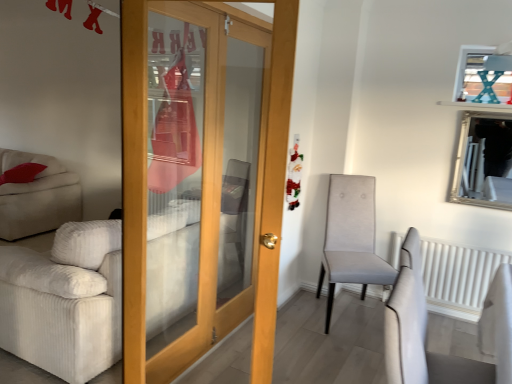
What do you see at coordinates (64, 299) in the screenshot?
I see `white corduroy couch at left` at bounding box center [64, 299].

Where is `silver/glass mirror at upper right`? This screenshot has height=384, width=512. silver/glass mirror at upper right is located at coordinates (483, 161).

Describe the element at coordinates (206, 185) in the screenshot. I see `wooden door at center` at that location.

I want to click on white corduroy couch at left, so click(x=64, y=299).

Does wooden door at center contain light gray fabric chair at center-right?

No, light gray fabric chair at center-right is not inside wooden door at center.

Is wooden door at center aimed at light gray fabric chair at center-right?

No.

What's the angular difference between wooden door at center and light gray fabric chair at center-right's facing directions?

The facing directions of wooden door at center and light gray fabric chair at center-right are 13.1 degrees apart.

From the image's perspective, is wooden door at center positioned above or below light gray fabric chair at center-right?

Based on their image positions, wooden door at center is located above light gray fabric chair at center-right.

Is white textured radiator at right shorter than white corduroy couch at left?

Correct, white textured radiator at right is not as tall as white corduroy couch at left.

Is white textured radiator at right aimed at white corduroy couch at left?

No, white textured radiator at right is not aimed at white corduroy couch at left.

Is point (473, 295) more distant than point (75, 277)?

Yes, it is.

Would you say light gray fabric chair at center-right contains white corduroy couch at left?

No, light gray fabric chair at center-right does not contain white corduroy couch at left.

From the image's perspective, relative to white corduroy couch at left, is light gray fabric chair at center-right above or below?

light gray fabric chair at center-right is above white corduroy couch at left.

Is light gray fabric chair at center-right far from white corduroy couch at left?

Indeed, light gray fabric chair at center-right is not near white corduroy couch at left.

Is light gray fabric chair at center-right positioned before white corduroy couch at left?

No, light gray fabric chair at center-right is further to the viewer.

Considering the relative sizes of light gray fabric chair at center-right and wooden door at center in the image provided, is light gray fabric chair at center-right bigger than wooden door at center?

Indeed, light gray fabric chair at center-right has a larger size compared to wooden door at center.

From the picture: Is light gray fabric chair at center-right touching wooden door at center?

light gray fabric chair at center-right is not next to wooden door at center, and they're not touching.

Is light gray fabric chair at center-right not inside wooden door at center?

Yes, light gray fabric chair at center-right is not within wooden door at center.

From a real-world perspective, is light gray fabric chair at center-right located beneath wooden door at center?

Indeed, from a real-world perspective, light gray fabric chair at center-right is positioned beneath wooden door at center.

From a real-world perspective, between wooden door at center and white corduroy couch at left, who is vertically higher?

wooden door at center is physically above.

From the image's perspective, which one is positioned lower, wooden door at center or white corduroy couch at left?

white corduroy couch at left is shown below in the image.

Who is more distant, wooden door at center or white corduroy couch at left?

Positioned behind is white corduroy couch at left.

The height and width of the screenshot is (384, 512). What are the coordinates of `door in front of the white corduroy couch at left` in the screenshot? It's located at (206, 185).

Which is in front, wooden door at center or white textured radiator at right?

wooden door at center is in front.

Based on the photo, which is closer to the camera, (256,302) or (436,293)?

The point (256,302) is closer to the camera.

From the image's perspective, relative to white textured radiator at right, is wooden door at center above or below?

wooden door at center is above white textured radiator at right.

From a real-world perspective, is wooden door at center over white textured radiator at right?

Correct, in the physical world, wooden door at center is higher than white textured radiator at right.

Looking at the image, does silver/glass mirror at upper right seem bigger or smaller compared to white textured radiator at right?

Considering their sizes, silver/glass mirror at upper right takes up less space than white textured radiator at right.

From a real-world perspective, which object stands above the other?

In real-world perspective, silver/glass mirror at upper right is above.

From the image's perspective, is silver/glass mirror at upper right below white textured radiator at right?

No.

Image resolution: width=512 pixels, height=384 pixels. Identify the location of door that appears above the light gray fabric chair at center-right (from a real-world perspective). click(206, 185).

At what (x,y) coordinates should I click in order to perform the action: click on studio couch in front of the white textured radiator at right. Please return your answer as a coordinate pair (x, y). Looking at the image, I should click on (64, 299).

When comparing their distances from white corduroy couch at left, does silver/glass mirror at upper right or white textured radiator at right seem closer?

white textured radiator at right is positioned closer to the anchor white corduroy couch at left.

Considering their positions, is silver/glass mirror at upper right positioned further to white corduroy couch at left than light gray fabric chair at center-right?

Based on the image, silver/glass mirror at upper right appears to be further to white corduroy couch at left.

From the image, which object appears to be farther from white corduroy couch at left, wooden door at center or silver/glass mirror at upper right?

Among the two, silver/glass mirror at upper right is located further to white corduroy couch at left.

Looking at the image, which one is located further to silver/glass mirror at upper right, light gray fabric chair at center-right or white textured radiator at right?

light gray fabric chair at center-right lies further to silver/glass mirror at upper right than the other object.

Looking at the image, which one is located further to white textured radiator at right, wooden door at center or silver/glass mirror at upper right?

wooden door at center lies further to white textured radiator at right than the other object.

When comparing their distances from light gray fabric chair at center-right, does wooden door at center or silver/glass mirror at upper right seem closer?

Among the two, silver/glass mirror at upper right is located nearer to light gray fabric chair at center-right.

In the scene shown: Considering their positions, is wooden door at center positioned further to white corduroy couch at left than light gray fabric chair at center-right?

Based on the image, light gray fabric chair at center-right appears to be further to white corduroy couch at left.

Based on their spatial positions, is white textured radiator at right or white corduroy couch at left further from silver/glass mirror at upper right?

white corduroy couch at left lies further to silver/glass mirror at upper right than the other object.

Locate an element on the screen. The image size is (512, 384). radiator situated between wooden door at center and silver/glass mirror at upper right from left to right is located at coordinates (458, 277).

This screenshot has height=384, width=512. I want to click on chair situated between white corduroy couch at left and silver/glass mirror at upper right from left to right, so click(351, 238).

At what (x,y) coordinates should I click in order to perform the action: click on chair between wooden door at center and silver/glass mirror at upper right from left to right. Please return your answer as a coordinate pair (x, y). Looking at the image, I should click on coord(351,238).

Identify the location of door between white corduroy couch at left and silver/glass mirror at upper right from left to right. This screenshot has width=512, height=384. (206, 185).